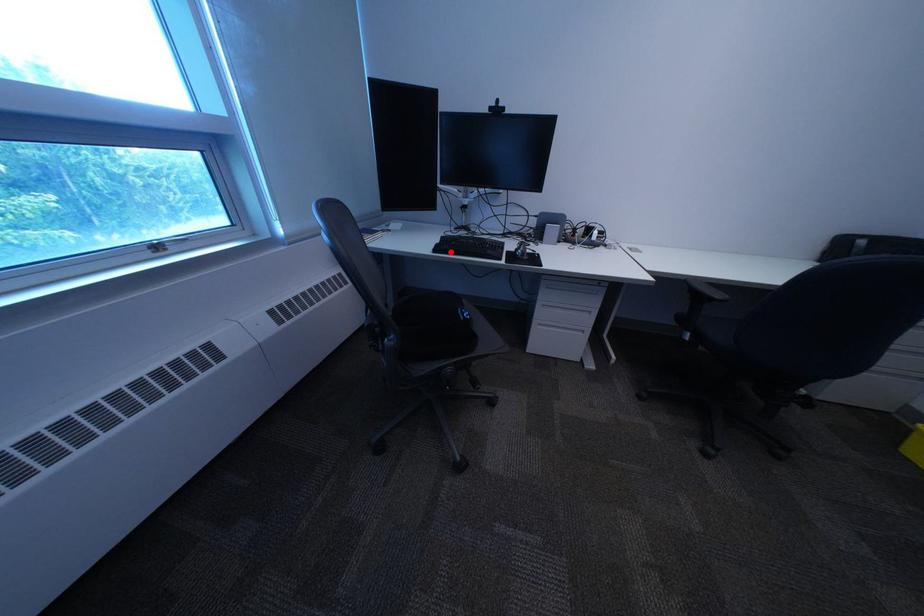
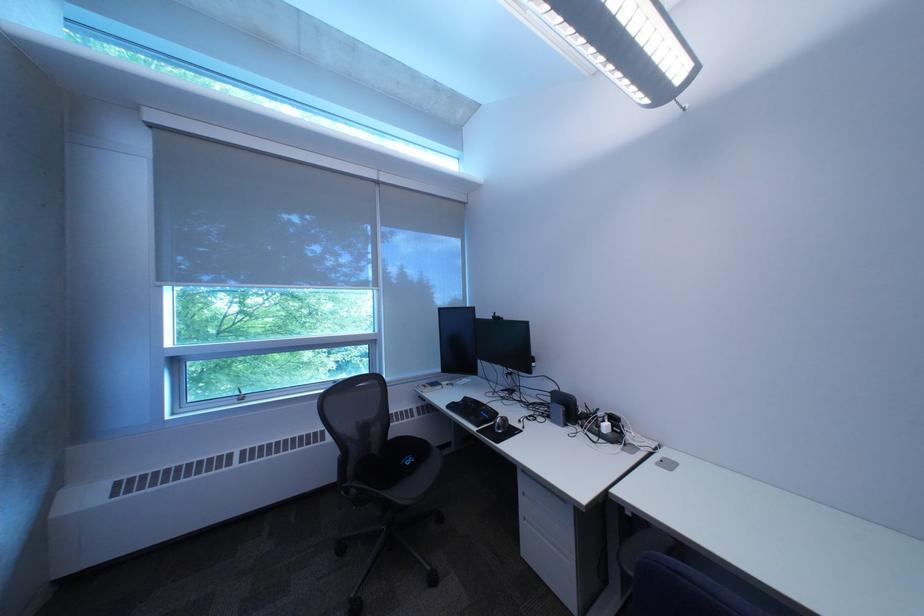
In the second image, find the point that corresponds to the highlighted location in the first image.

(464, 408)